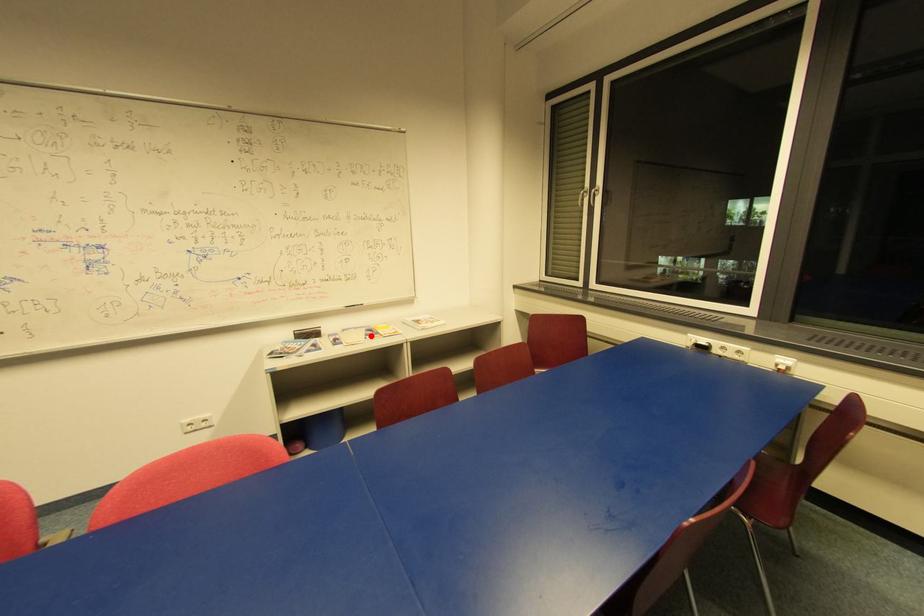
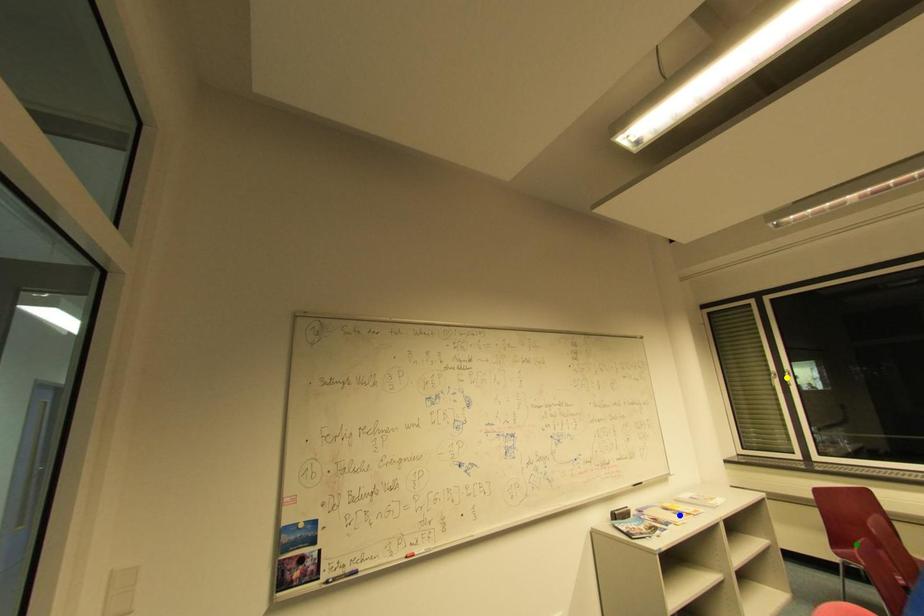
Question: I am providing you with two images of the same scene from different viewpoints. A red point is marked on the first image. You are given multiple points on the second image. Which spot in image 2 lines up with the point in image 1?

Choices:
 (A) blue point
 (B) green point
 (C) yellow point

Answer: (A)